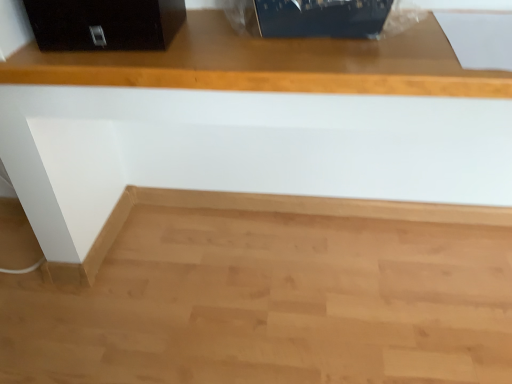
What is the approximate height of black glossy file cabinet at upper left?

black glossy file cabinet at upper left is 5.28 inches in height.

Image resolution: width=512 pixels, height=384 pixels. I want to click on black glossy file cabinet at upper left, so click(105, 24).

This screenshot has height=384, width=512. What do you see at coordinates (105, 24) in the screenshot?
I see `black glossy file cabinet at upper left` at bounding box center [105, 24].

Describe the element at coordinates (271, 64) in the screenshot. I see `natural wood cabinet at upper center` at that location.

Consider the image. In order to face natural wood cabinet at upper center, should I rotate leftwards or rightwards?

Rotate right and turn 5.444 degrees.

You are a GUI agent. You are given a task and a screenshot of the screen. Output one action in this format:
    pyautogui.click(x=<x>, y=<y>)
    Task: Click on the natural wood cabinet at upper center
    Image resolution: width=512 pixels, height=384 pixels.
    Given the screenshot: What is the action you would take?
    pyautogui.click(x=271, y=64)

You are a GUI agent. You are given a task and a screenshot of the screen. Output one action in this format:
    pyautogui.click(x=<x>, y=<y>)
    Task: Click on the black glossy file cabinet at upper left
    The height and width of the screenshot is (384, 512).
    Given the screenshot: What is the action you would take?
    pyautogui.click(x=105, y=24)

Does black glossy file cabinet at upper left appear on the right side of natural wood cabinet at upper center?

No.

Is black glossy file cabinet at upper left closer to the viewer compared to natural wood cabinet at upper center?

No, black glossy file cabinet at upper left is further to the viewer.

Which is in front, point (145, 4) or point (64, 274)?

The point (145, 4) is in front.

From the picture: From the image's perspective, is black glossy file cabinet at upper left positioned above or below natural wood cabinet at upper center?

From the image's perspective, black glossy file cabinet at upper left appears above natural wood cabinet at upper center.

From a real-world perspective, between black glossy file cabinet at upper left and natural wood cabinet at upper center, who is vertically higher?

From a 3D spatial view, black glossy file cabinet at upper left is above.

Is black glossy file cabinet at upper left thinner than natural wood cabinet at upper center?

Yes, black glossy file cabinet at upper left is thinner than natural wood cabinet at upper center.

Who is taller, black glossy file cabinet at upper left or natural wood cabinet at upper center?

natural wood cabinet at upper center.

Can you confirm if black glossy file cabinet at upper left is smaller than natural wood cabinet at upper center?

Yes, black glossy file cabinet at upper left is smaller than natural wood cabinet at upper center.

Is black glossy file cabinet at upper left inside or outside of natural wood cabinet at upper center?

black glossy file cabinet at upper left lies within the bounds of natural wood cabinet at upper center.

Is black glossy file cabinet at upper left placed right next to natural wood cabinet at upper center?

There is a gap between black glossy file cabinet at upper left and natural wood cabinet at upper center.

Is black glossy file cabinet at upper left facing away from natural wood cabinet at upper center?

Yes, black glossy file cabinet at upper left is positioned with its back facing natural wood cabinet at upper center.

In the scene shown: How different are the orientations of black glossy file cabinet at upper left and natural wood cabinet at upper center in degrees?

The angle between the facing direction of black glossy file cabinet at upper left and the facing direction of natural wood cabinet at upper center is 2.54 degrees.

Find the location of a particular element. This screenshot has height=384, width=512. furniture located on the right of black glossy file cabinet at upper left is located at coordinates (271, 64).

Which object is positioned more to the right, natural wood cabinet at upper center or black glossy file cabinet at upper left?

From the viewer's perspective, natural wood cabinet at upper center appears more on the right side.

Is natural wood cabinet at upper center further to the viewer compared to black glossy file cabinet at upper left?

That is False.

Does point (463, 73) come farther from viewer compared to point (161, 18)?

That is False.

From the image's perspective, relative to black glossy file cabinet at upper left, is natural wood cabinet at upper center above or below?

Based on their image positions, natural wood cabinet at upper center is located beneath black glossy file cabinet at upper left.

From a real-world perspective, between natural wood cabinet at upper center and black glossy file cabinet at upper left, who is vertically higher?

black glossy file cabinet at upper left, from a real-world perspective.

From the picture: Does natural wood cabinet at upper center have a greater width compared to black glossy file cabinet at upper left?

Yes, natural wood cabinet at upper center is wider than black glossy file cabinet at upper left.

Who is taller, natural wood cabinet at upper center or black glossy file cabinet at upper left?

natural wood cabinet at upper center.

Does natural wood cabinet at upper center have a smaller size compared to black glossy file cabinet at upper left?

Incorrect, natural wood cabinet at upper center is not smaller in size than black glossy file cabinet at upper left.

Could black glossy file cabinet at upper left be considered to be inside natural wood cabinet at upper center?

Yes, black glossy file cabinet at upper left is a part of natural wood cabinet at upper center.

Is the surface of natural wood cabinet at upper center in direct contact with black glossy file cabinet at upper left?

natural wood cabinet at upper center and black glossy file cabinet at upper left are not in contact.

Could you tell me if natural wood cabinet at upper center is facing black glossy file cabinet at upper left?

No, natural wood cabinet at upper center is not turned towards black glossy file cabinet at upper left.

How many degrees apart are the facing directions of natural wood cabinet at upper center and black glossy file cabinet at upper left?

The angle between the facing direction of natural wood cabinet at upper center and the facing direction of black glossy file cabinet at upper left is 2.54 degrees.

Based on the photo, could you measure the distance between natural wood cabinet at upper center and black glossy file cabinet at upper left?

natural wood cabinet at upper center and black glossy file cabinet at upper left are 5.30 inches apart from each other.

Locate an element on the screen. file cabinet that is above the natural wood cabinet at upper center (from a real-world perspective) is located at coordinates (105, 24).

Identify the location of file cabinet above the natural wood cabinet at upper center (from a real-world perspective). (105, 24).

I want to click on file cabinet that is behind the natural wood cabinet at upper center, so click(x=105, y=24).